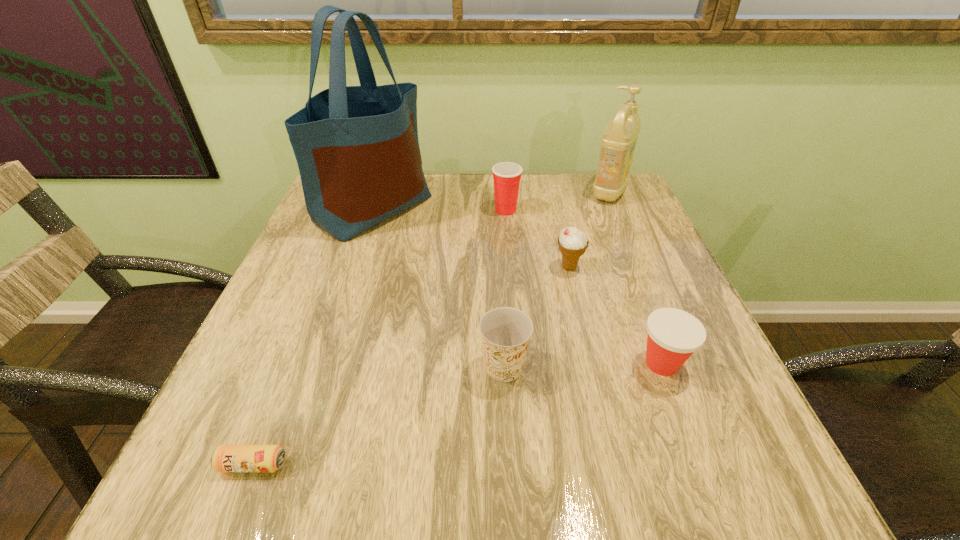
Locate an element on the screen. The width and height of the screenshot is (960, 540). vacant space located on the front of the farthest Dixie cup is located at coordinates (510, 256).

I want to click on blank space located 0.320m on the back of the fourth farthest object, so click(550, 187).

At what (x,y) coordinates should I click in order to perform the action: click on vacant space situated 0.130m on the back of the rightmost Dixie cup. Please return your answer as a coordinate pair (x, y). Image resolution: width=960 pixels, height=540 pixels. Looking at the image, I should click on (636, 295).

The height and width of the screenshot is (540, 960). In order to click on vacant space situated 0.310m on the right of the shortest object in this screenshot , I will do `click(498, 464)`.

Where is `handbag at the far edge`? handbag at the far edge is located at coordinates [x=357, y=149].

The height and width of the screenshot is (540, 960). I want to click on detergent situated at the far edge, so click(618, 142).

What are the coordinates of `Dixie cup that is positioned at the far edge` in the screenshot? It's located at (507, 175).

The height and width of the screenshot is (540, 960). I want to click on object that is positioned at the near edge, so click(x=226, y=458).

The image size is (960, 540). Find the location of `handbag at the left edge`. handbag at the left edge is located at coordinates (357, 149).

You are a GUI agent. You are given a task and a screenshot of the screen. Output one action in this format:
    pyautogui.click(x=<x>, y=<y>)
    Task: Click on the beer can that is positioned at the left edge
    The width and height of the screenshot is (960, 540).
    Given the screenshot: What is the action you would take?
    pyautogui.click(x=226, y=458)